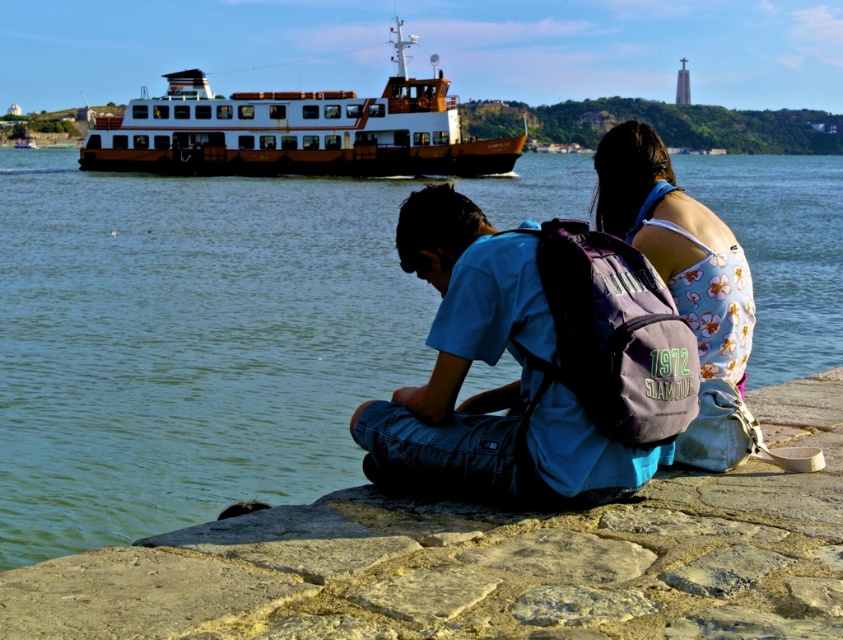
Question: Does blue cotton shirt at center have a greater width compared to brown wooden ferry at upper left?

Choices:
 (A) yes
 (B) no

Answer: (B)

Question: Which point appears closest to the camera in this image?

Choices:
 (A) (309, 124)
 (B) (254, 333)
 (C) (733, 368)

Answer: (C)

Question: Which object is the farthest from the brown wooden ferry at upper left?

Choices:
 (A) green water at lower left
 (B) floral fabric tank top at center
 (C) blue cotton shirt at center

Answer: (C)

Question: Can you confirm if brown wooden ferry at upper left is wider than floral fabric tank top at center?

Choices:
 (A) no
 (B) yes

Answer: (B)

Question: Which is farther from the green water at lower left?

Choices:
 (A) floral fabric tank top at center
 (B) brown wooden ferry at upper left

Answer: (A)

Question: Is green water at lower left smaller than brown wooden ferry at upper left?

Choices:
 (A) no
 (B) yes

Answer: (A)